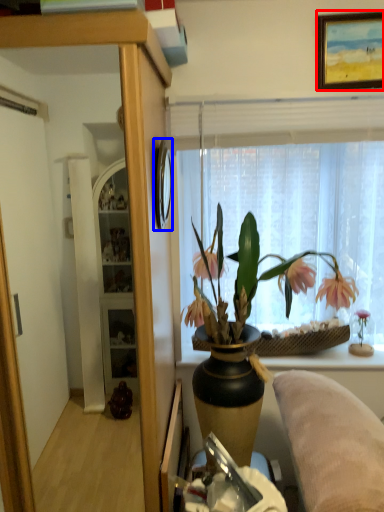
Question: Which object appears farthest to the camera in this image, picture frame (highlighted by a red box) or picture frame (highlighted by a blue box)?

Choices:
 (A) picture frame
 (B) picture frame

Answer: (A)